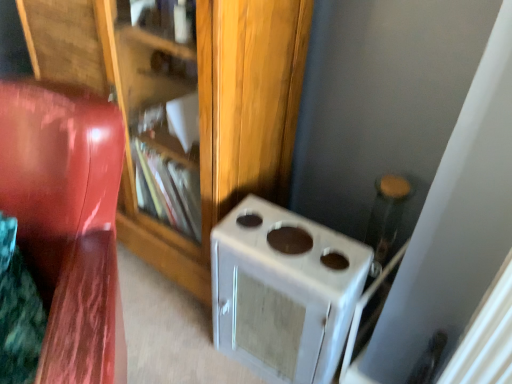
Question: Is wooden bookshelf at center located outside glossy wood chair at left?

Choices:
 (A) yes
 (B) no

Answer: (A)

Question: Is wooden bookshelf at center at the right side of glossy wood chair at left?

Choices:
 (A) no
 (B) yes

Answer: (B)

Question: Considering the relative sizes of wooden bookshelf at center and glossy wood chair at left in the image provided, is wooden bookshelf at center smaller than glossy wood chair at left?

Choices:
 (A) yes
 (B) no

Answer: (B)

Question: Can you confirm if wooden bookshelf at center is shorter than glossy wood chair at left?

Choices:
 (A) yes
 (B) no

Answer: (B)

Question: From the image's perspective, is wooden bookshelf at center beneath glossy wood chair at left?

Choices:
 (A) yes
 (B) no

Answer: (B)

Question: Looking at their shapes, would you say white matte stove at lower right is wider or thinner than glossy wood chair at left?

Choices:
 (A) thin
 (B) wide

Answer: (A)

Question: Which is correct: white matte stove at lower right is inside glossy wood chair at left, or outside of it?

Choices:
 (A) inside
 (B) outside

Answer: (B)

Question: Considering the positions of point (266, 215) and point (100, 349), is point (266, 215) closer or farther from the camera than point (100, 349)?

Choices:
 (A) closer
 (B) farther

Answer: (B)

Question: From a real-world perspective, relative to glossy wood chair at left, is white matte stove at lower right vertically above or below?

Choices:
 (A) above
 (B) below

Answer: (B)

Question: Is wooden bookshelf at center inside the boundaries of white matte stove at lower right, or outside?

Choices:
 (A) outside
 (B) inside

Answer: (A)

Question: Is wooden bookshelf at center bigger or smaller than white matte stove at lower right?

Choices:
 (A) small
 (B) big

Answer: (B)

Question: Considering their positions, is wooden bookshelf at center located in front of or behind white matte stove at lower right?

Choices:
 (A) front
 (B) behind

Answer: (A)

Question: Looking at their shapes, would you say wooden bookshelf at center is wider or thinner than white matte stove at lower right?

Choices:
 (A) wide
 (B) thin

Answer: (A)

Question: Is wooden bookshelf at center situated inside glossy wood chair at left or outside?

Choices:
 (A) outside
 (B) inside

Answer: (A)

Question: From a real-world perspective, is wooden bookshelf at center positioned above or below glossy wood chair at left?

Choices:
 (A) below
 (B) above

Answer: (B)